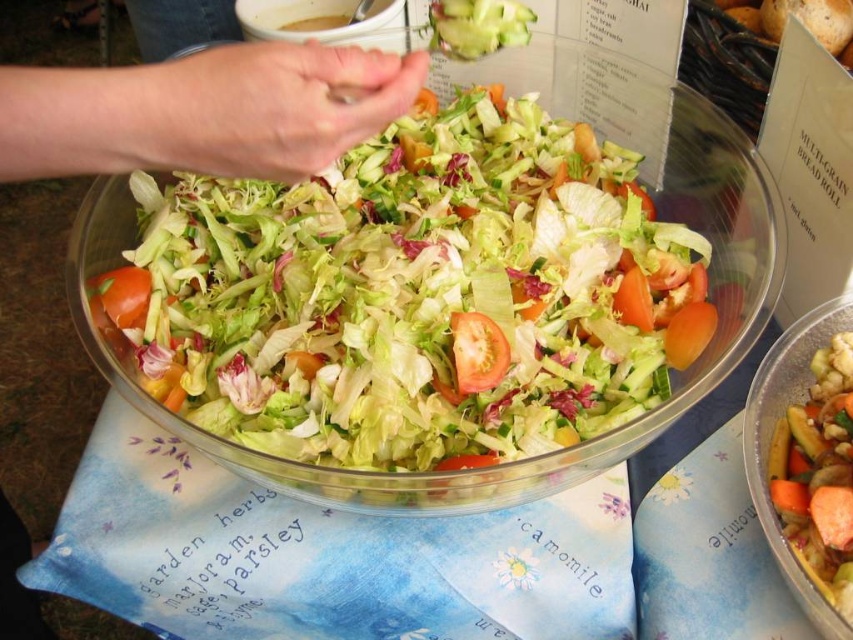
Is the position of fresh green salad at center more distant than that of red matte tomato at lower left?

No, it is in front of red matte tomato at lower left.

Who is positioned more to the right, fresh green salad at center or red matte tomato at lower left?

fresh green salad at center

Is point (329, 216) farther from camera compared to point (138, 301)?

Yes, it is behind point (138, 301).

The height and width of the screenshot is (640, 853). Find the location of `fresh green salad at center`. fresh green salad at center is located at coordinates (416, 294).

Does fresh green salad at center have a smaller size compared to skinny white hand at upper left?

No, fresh green salad at center is not smaller than skinny white hand at upper left.

Does fresh green salad at center appear under skinny white hand at upper left?

Correct, fresh green salad at center is located below skinny white hand at upper left.

Where is `fresh green salad at center`? The width and height of the screenshot is (853, 640). fresh green salad at center is located at coordinates pos(416,294).

The height and width of the screenshot is (640, 853). I want to click on fresh green salad at center, so click(x=416, y=294).

Is translucent plastic salad bowl at center bigger than red matte tomato at lower left?

Yes.

Is translucent plastic salad bowl at center to the right of red matte tomato at lower left from the viewer's perspective?

Correct, you'll find translucent plastic salad bowl at center to the right of red matte tomato at lower left.

What do you see at coordinates (770, 440) in the screenshot? The height and width of the screenshot is (640, 853). I see `translucent plastic salad bowl at center` at bounding box center [770, 440].

Find the location of a particular element. This screenshot has width=853, height=640. translucent plastic salad bowl at center is located at coordinates (770, 440).